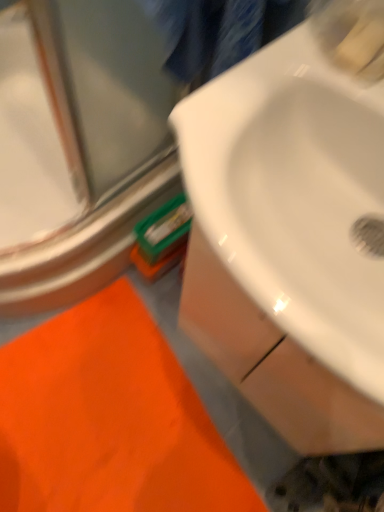
Measure the distance between point (8, 154) and camera.

Point (8, 154) and camera are 1.28 meters apart.

Image resolution: width=384 pixels, height=512 pixels. What do you see at coordinates (298, 189) in the screenshot? I see `white glossy sink at center` at bounding box center [298, 189].

Locate an element on the screen. orange fabric bath mat at lower left is located at coordinates (109, 419).

From a real-world perspective, is white glossy sink at center positioned over orange fabric bath mat at lower left based on gravity?

Indeed, from a real-world perspective, white glossy sink at center stands above orange fabric bath mat at lower left.

Is white glossy sink at center inside or outside of orange fabric bath mat at lower left?

white glossy sink at center cannot be found inside orange fabric bath mat at lower left.

Based on the photo, which point is more forward, (327, 11) or (207, 440)?

The point (327, 11) is closer.

Can you confirm if clear glass door at upper left is positioned to the left of white glossy sink at center?

Indeed, clear glass door at upper left is positioned on the left side of white glossy sink at center.

Considering the positions of objects clear glass door at upper left and white glossy sink at center in the image provided, who is behind, clear glass door at upper left or white glossy sink at center?

clear glass door at upper left is behind.

From a real-world perspective, is clear glass door at upper left physically below white glossy sink at center?

Indeed, from a real-world perspective, clear glass door at upper left is positioned beneath white glossy sink at center.

Identify the location of glass door above the white glossy sink at center (from the image's perspective). (78, 146).

Could you tell me if orange fabric bath mat at lower left is facing white glossy sink at center?

No, orange fabric bath mat at lower left is not facing towards white glossy sink at center.

Considering the positions of objects orange fabric bath mat at lower left and white glossy sink at center in the image provided, who is in front, orange fabric bath mat at lower left or white glossy sink at center?

white glossy sink at center is closer to the camera.

Is orange fabric bath mat at lower left next to white glossy sink at center?

No, orange fabric bath mat at lower left is not with white glossy sink at center.

Considering the positions of points (102, 348) and (358, 177), is point (102, 348) farther from camera compared to point (358, 177)?

Yes.

Is orange fabric bath mat at lower left oriented away from clear glass door at upper left?

No, clear glass door at upper left is not at the back of orange fabric bath mat at lower left.

From the image's perspective, is orange fabric bath mat at lower left above or below clear glass door at upper left?

orange fabric bath mat at lower left is situated lower than clear glass door at upper left in the image.

From a real-world perspective, is orange fabric bath mat at lower left on top of clear glass door at upper left?

Incorrect, from a real-world perspective, orange fabric bath mat at lower left is lower than clear glass door at upper left.

Identify the location of glass door on the left of the orange fabric bath mat at lower left. click(78, 146).

From a real-world perspective, is white glossy sink at center on clear glass door at upper left?

Correct, in the physical world, white glossy sink at center is higher than clear glass door at upper left.

Between white glossy sink at center and clear glass door at upper left, which one has smaller width?

Thinner between the two is white glossy sink at center.

Does white glossy sink at center turn towards clear glass door at upper left?

No, white glossy sink at center is not aimed at clear glass door at upper left.

Which is behind, point (329, 178) or point (81, 164)?

The point (81, 164) is behind.

Can you confirm if clear glass door at upper left is shorter than orange fabric bath mat at lower left?

Incorrect, the height of clear glass door at upper left does not fall short of that of orange fabric bath mat at lower left.

This screenshot has height=512, width=384. I want to click on bath mat below the clear glass door at upper left (from the image's perspective), so click(x=109, y=419).

Would you say clear glass door at upper left is inside or outside orange fabric bath mat at lower left?

clear glass door at upper left exists outside the volume of orange fabric bath mat at lower left.

The width and height of the screenshot is (384, 512). Find the location of `bath mat on the left of white glossy sink at center`. bath mat on the left of white glossy sink at center is located at coordinates (109, 419).

Where is `sink on the right of clear glass door at upper left`? The width and height of the screenshot is (384, 512). sink on the right of clear glass door at upper left is located at coordinates (298, 189).

Looking at the image, which one is located further to clear glass door at upper left, orange fabric bath mat at lower left or white glossy sink at center?

white glossy sink at center is further to clear glass door at upper left.

Which object lies nearer to the anchor point orange fabric bath mat at lower left, white glossy sink at center or clear glass door at upper left?

clear glass door at upper left is closer to orange fabric bath mat at lower left.

Based on their spatial positions, is white glossy sink at center or orange fabric bath mat at lower left closer to clear glass door at upper left?

orange fabric bath mat at lower left is closer to clear glass door at upper left.

Estimate the real-world distances between objects in this image. Which object is further from white glossy sink at center, clear glass door at upper left or orange fabric bath mat at lower left?

Based on the image, orange fabric bath mat at lower left appears to be further to white glossy sink at center.

Looking at the image, which one is located further to orange fabric bath mat at lower left, clear glass door at upper left or white glossy sink at center?

Based on the image, white glossy sink at center appears to be further to orange fabric bath mat at lower left.

From the image, which object appears to be farther from white glossy sink at center, orange fabric bath mat at lower left or clear glass door at upper left?

orange fabric bath mat at lower left is positioned further to the anchor white glossy sink at center.

The height and width of the screenshot is (512, 384). I want to click on bath mat between clear glass door at upper left and white glossy sink at center in the horizontal direction, so click(x=109, y=419).